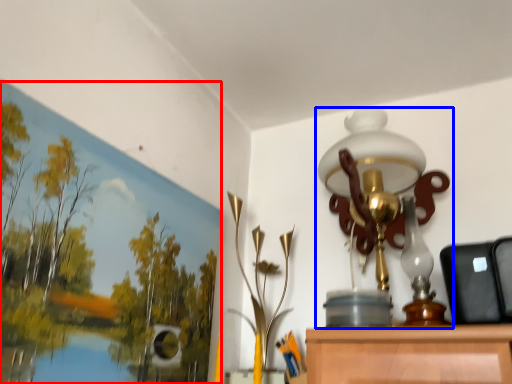
Question: Among these objects, which one is nearest to the camera, oil painting (highlighted by a red box) or lamp (highlighted by a blue box)?

Choices:
 (A) oil painting
 (B) lamp

Answer: (A)